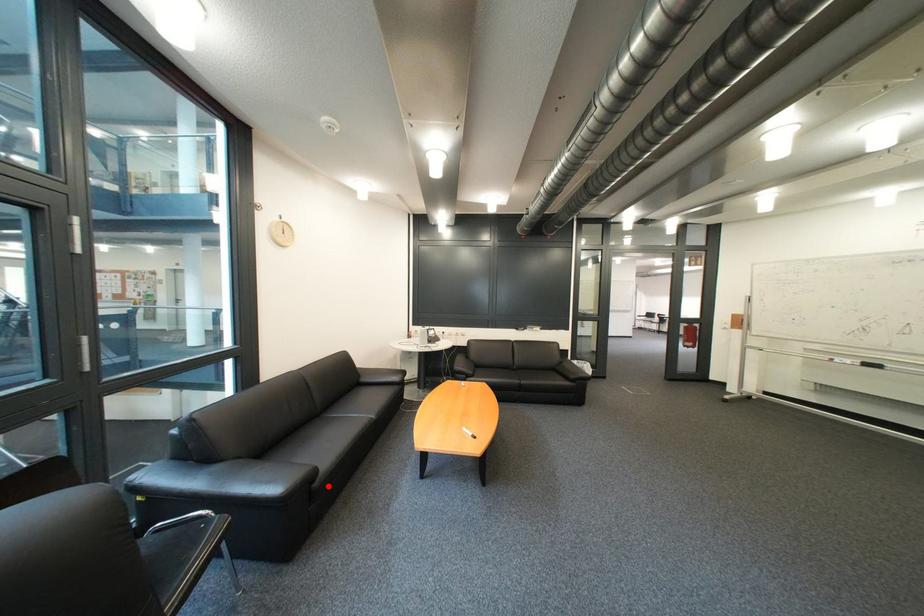
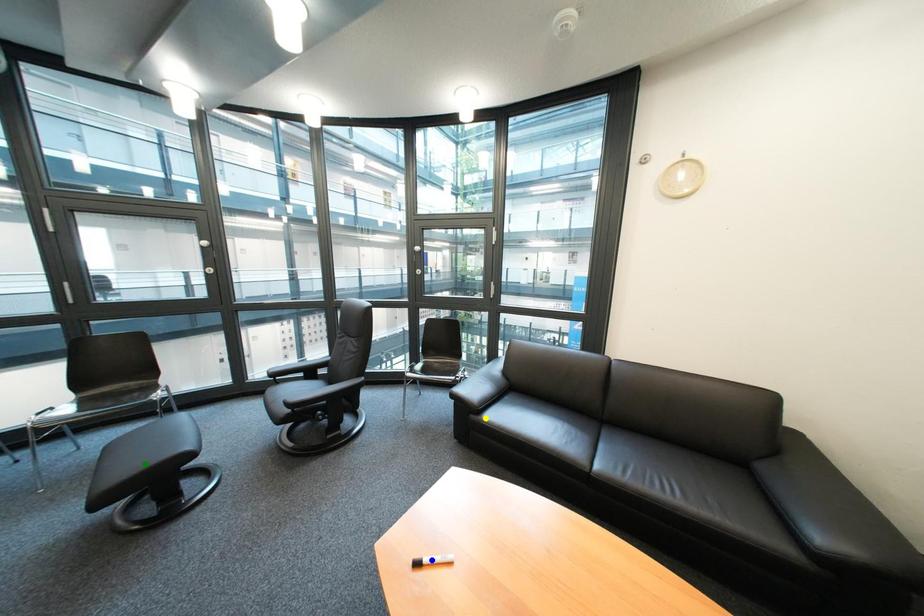
Question: I am providing you with two images of the same scene from different viewpoints. A red point is marked on the first image. You are given multiple points on the second image. In image 2, which mark is for the same physical point as the one in image 1?

Choices:
 (A) blue point
 (B) yellow point
 (C) green point

Answer: (B)